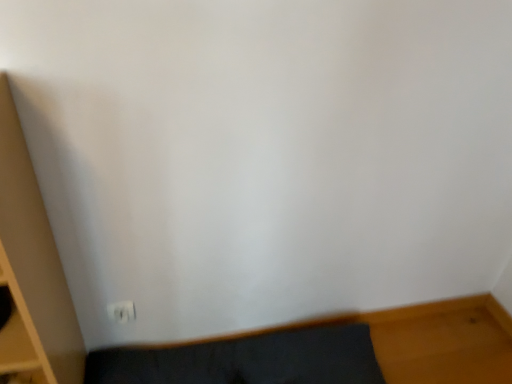
Question: Should I look upward or downward to see white plastic electric outlet at lower left?

Choices:
 (A) down
 (B) up

Answer: (A)

Question: From the image's perspective, does white plastic electric outlet at lower left appear higher than dark gray fabric rug at lower left?

Choices:
 (A) yes
 (B) no

Answer: (A)

Question: Does white plastic electric outlet at lower left appear on the left side of dark gray fabric rug at lower left?

Choices:
 (A) yes
 (B) no

Answer: (A)

Question: Is white plastic electric outlet at lower left directly adjacent to dark gray fabric rug at lower left?

Choices:
 (A) yes
 (B) no

Answer: (B)

Question: Would you say white plastic electric outlet at lower left is outside dark gray fabric rug at lower left?

Choices:
 (A) yes
 (B) no

Answer: (A)

Question: Considering the relative sizes of white plastic electric outlet at lower left and dark gray fabric rug at lower left in the image provided, is white plastic electric outlet at lower left shorter than dark gray fabric rug at lower left?

Choices:
 (A) yes
 (B) no

Answer: (A)

Question: Can you confirm if white plastic electric outlet at lower left is positioned to the right of dark gray fabric rug at lower left?

Choices:
 (A) yes
 (B) no

Answer: (B)

Question: From a real-world perspective, is dark gray fabric rug at lower left beneath white plastic electric outlet at lower left?

Choices:
 (A) no
 (B) yes

Answer: (B)

Question: Does dark gray fabric rug at lower left appear on the left side of white plastic electric outlet at lower left?

Choices:
 (A) yes
 (B) no

Answer: (B)

Question: Does dark gray fabric rug at lower left appear on the right side of white plastic electric outlet at lower left?

Choices:
 (A) no
 (B) yes

Answer: (B)

Question: Can you confirm if dark gray fabric rug at lower left is taller than white plastic electric outlet at lower left?

Choices:
 (A) no
 (B) yes

Answer: (B)

Question: Is white plastic electric outlet at lower left at the back of dark gray fabric rug at lower left?

Choices:
 (A) yes
 (B) no

Answer: (B)

Question: From the image's perspective, is dark gray fabric rug at lower left on top of white plastic electric outlet at lower left?

Choices:
 (A) yes
 (B) no

Answer: (B)

Question: From a real-world perspective, is white plastic electric outlet at lower left above or below dark gray fabric rug at lower left?

Choices:
 (A) above
 (B) below

Answer: (A)